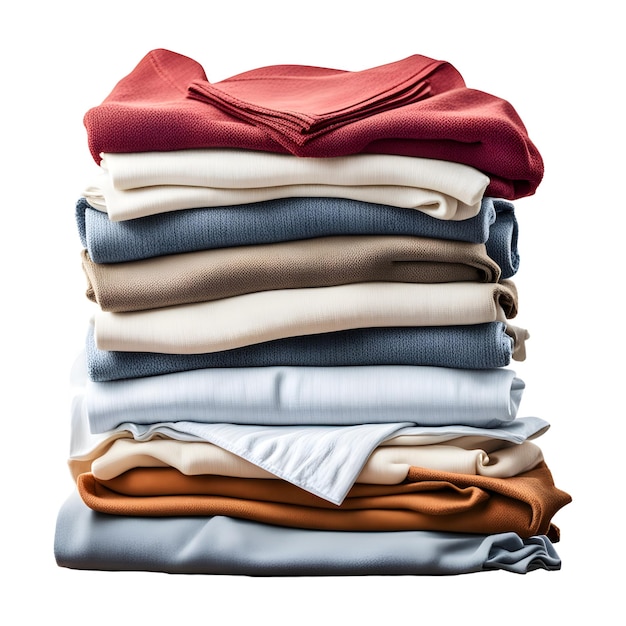
The height and width of the screenshot is (626, 626). What are the coordinates of `fabric` in the screenshot? It's located at (421, 567), (443, 511), (453, 449), (444, 401), (426, 351), (438, 313), (351, 269), (359, 223), (391, 183), (443, 129).